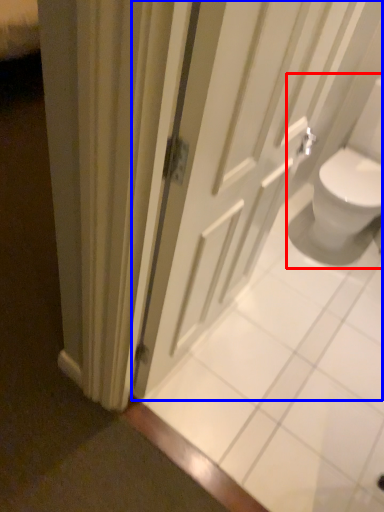
Question: Which point is closer to the camera, sink (highlighted by a red box) or door (highlighted by a blue box)?

Choices:
 (A) sink
 (B) door

Answer: (B)